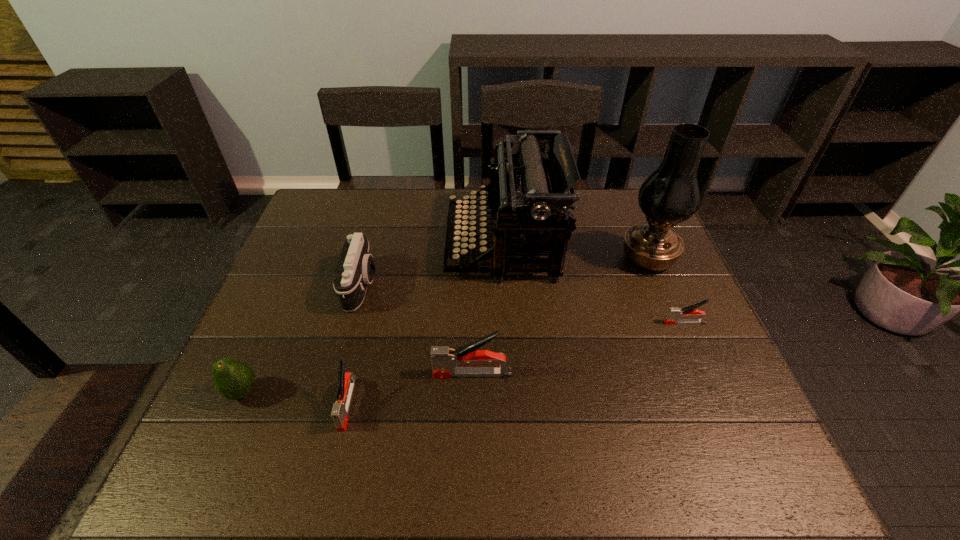
This screenshot has height=540, width=960. Identify the location of vacant region that satisfies the following two spatial constraints: 1. on the handle side of the shortest stapler; 2. on the front side of the avocado. (715, 393).